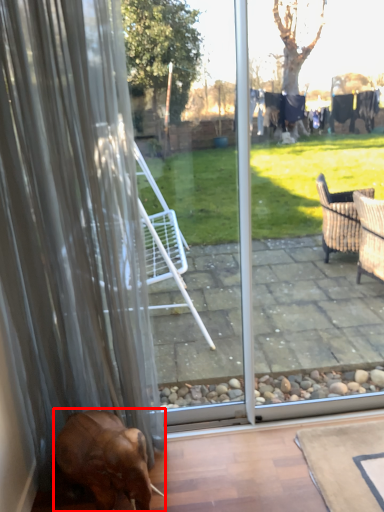
Question: From the image's perspective, where is dog (annotated by the red box) located in relation to curtain in the image?

Choices:
 (A) below
 (B) above

Answer: (A)